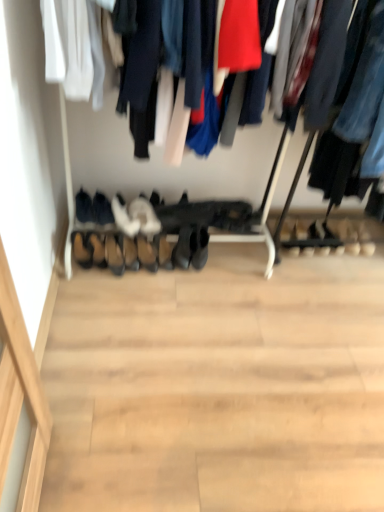
Measure the distance between brown leather shoe at lower center, which appears as the second shoe when viewed from the left, and camera.

The distance of brown leather shoe at lower center, which appears as the second shoe when viewed from the left, from camera is 2.08 meters.

This screenshot has width=384, height=512. Identify the location of brown leather shoe at lower center, which is the third shoe in right-to-left order. (96, 249).

Find the location of a particular element. Image resolution: width=384 pixels, height=512 pixels. brown suede shoes at center, acting as the third footwear starting from the left is located at coordinates (114, 255).

Measure the distance between point [117,251] and camera.

The distance of point [117,251] from camera is 6.87 feet.

Describe the element at coordinates (84, 207) in the screenshot. I see `black suede shoes at lower left, positioned as the 1th footwear in left-to-right order` at that location.

This screenshot has width=384, height=512. What are the coordinates of `white suede shoes at center, the 3th footwear when ordered from right to left` in the screenshot? It's located at (124, 217).

Image resolution: width=384 pixels, height=512 pixels. Describe the element at coordinates (147, 254) in the screenshot. I see `brown leather shoe at center, the 6th footwear viewed from the left` at that location.

Looking at this image, measure the distance between point (149, 261) and camera.

They are 2.13 meters apart.

At what (x,y) coordinates should I click in order to perform the action: click on white suede shoes at center, which is the 2th footwear in right-to-left order. Please return your answer as a coordinate pair (x, y). The image size is (384, 512). Looking at the image, I should click on (145, 216).

The height and width of the screenshot is (512, 384). Identify the location of brown leather shoe at lower center, which is the third shoe in right-to-left order. (96, 249).

Considering the positions of objects brown suede shoes at center, which is counted as the 4th footwear, starting from the right, and leather at center, the fourth shoe in the left-to-right sequence, in the image provided, who is more to the left, brown suede shoes at center, which is counted as the 4th footwear, starting from the right, or leather at center, the fourth shoe in the left-to-right sequence,?

brown suede shoes at center, which is counted as the 4th footwear, starting from the right, is more to the left.

Can you confirm if brown suede shoes at center, which is counted as the 4th footwear, starting from the right, is wider than leather at center, the fourth shoe in the left-to-right sequence?

Yes, brown suede shoes at center, which is counted as the 4th footwear, starting from the right, is wider than leather at center, the fourth shoe in the left-to-right sequence.

Where is `the 1st shoe above when counting from the brown suede shoes at center, which is counted as the 4th footwear, starting from the right (from the image's perspective)`? This screenshot has height=512, width=384. the 1st shoe above when counting from the brown suede shoes at center, which is counted as the 4th footwear, starting from the right (from the image's perspective) is located at coordinates (165, 253).

From the image's perspective, would you say white suede shoes at center, which is the 2th footwear in right-to-left order, is shown under brown leather shoe at lower center, which is the third shoe in right-to-left order?

No, from the image's perspective, white suede shoes at center, which is the 2th footwear in right-to-left order, is not below brown leather shoe at lower center, which is the third shoe in right-to-left order.

Can you confirm if white suede shoes at center, which is the 2th footwear in right-to-left order, is bigger than brown leather shoe at lower center, which is the third shoe in right-to-left order?

Correct, white suede shoes at center, which is the 2th footwear in right-to-left order, is larger in size than brown leather shoe at lower center, which is the third shoe in right-to-left order.

From the image's perspective, count 1st footwears upward from the brown leather shoe at lower center, which appears as the second shoe when viewed from the left, and point to it. Please provide its 2D coordinates.

[(145, 216)]

You are a GUI agent. You are given a task and a screenshot of the screen. Output one action in this format:
    pyautogui.click(x=<x>, y=<y>)
    Task: Click on the 3rd footwear above the white suede shoes at center, which is the 2th footwear in right-to-left order (from the image's perspective)
    The image size is (384, 512).
    Given the screenshot: What is the action you would take?
    pyautogui.click(x=84, y=207)

Does black suede shoes at lower left, positioned as the 1th footwear in left-to-right order, lie in front of white suede shoes at center, which is the 2th footwear in right-to-left order?

Yes, black suede shoes at lower left, positioned as the 1th footwear in left-to-right order, is in front of white suede shoes at center, which is the 2th footwear in right-to-left order.

Between black suede shoes at lower left, positioned as the 1th footwear in left-to-right order, and white suede shoes at center, which is the 2th footwear in right-to-left order, which one has more height?

black suede shoes at lower left, positioned as the 1th footwear in left-to-right order.

Considering the sizes of objects brown suede shoes at center, which is counted as the 4th footwear, starting from the right, and brown leather shoe at center, the 6th footwear viewed from the left, in the image provided, who is shorter, brown suede shoes at center, which is counted as the 4th footwear, starting from the right, or brown leather shoe at center, the 6th footwear viewed from the left,?

brown suede shoes at center, which is counted as the 4th footwear, starting from the right, is shorter.

In the image, there is a brown leather shoe at center, the 6th footwear viewed from the left. Identify the location of footwear below it (from the image's perspective). (114, 255).

From a real-world perspective, is brown suede shoes at center, acting as the third footwear starting from the left, located beneath brown leather shoe at center, which ranks as the 1th footwear in right-to-left order?

Indeed, from a real-world perspective, brown suede shoes at center, acting as the third footwear starting from the left, is positioned beneath brown leather shoe at center, which ranks as the 1th footwear in right-to-left order.

Considering the sizes of brown suede shoes at center, acting as the third footwear starting from the left, and brown leather shoe at center, the 6th footwear viewed from the left, in the image, is brown suede shoes at center, acting as the third footwear starting from the left, bigger or smaller than brown leather shoe at center, the 6th footwear viewed from the left,?

Clearly, brown suede shoes at center, acting as the third footwear starting from the left, is larger in size than brown leather shoe at center, the 6th footwear viewed from the left.

Does brown leather shoe at lower center, which appears as the second shoe when viewed from the left, come behind white suede shoes at center, the 3th footwear when ordered from right to left?

No, brown leather shoe at lower center, which appears as the second shoe when viewed from the left, is in front of white suede shoes at center, the 3th footwear when ordered from right to left.

What's the angular difference between brown leather shoe at lower center, which appears as the second shoe when viewed from the left, and white suede shoes at center, the 3th footwear when ordered from right to left,'s facing directions?

19 degrees.

Who is smaller, brown leather shoe at lower center, which is the third shoe in right-to-left order, or white suede shoes at center, the 3th footwear when ordered from right to left?

Smaller between the two is brown leather shoe at lower center, which is the third shoe in right-to-left order.

Is brown leather shoe at lower center, which is the third shoe in right-to-left order, to the right of white suede shoes at center, the 3th footwear when ordered from right to left, from the viewer's perspective?

No, brown leather shoe at lower center, which is the third shoe in right-to-left order, is not to the right of white suede shoes at center, the 3th footwear when ordered from right to left.

Considering the relative sizes of white suede shoes at center, which is the 2th footwear in right-to-left order, and leather shoes at center, the 2th shoe positioned from the right, in the image provided, is white suede shoes at center, which is the 2th footwear in right-to-left order, thinner than leather shoes at center, the 2th shoe positioned from the right,?

No.

From a real-world perspective, which shoe is the 3rd one underneath the white suede shoes at center, which is the fifth footwear from left to right? Please provide its 2D coordinates.

[(130, 253)]

Looking at this image, is white suede shoes at center, which is the 2th footwear in right-to-left order, far away from leather shoes at center, the 2th shoe positioned from the right?

No, white suede shoes at center, which is the 2th footwear in right-to-left order, is not far from leather shoes at center, the 2th shoe positioned from the right.

Relative to leather shoes at center, the 2th shoe positioned from the right, is white suede shoes at center, which is the 2th footwear in right-to-left order, in front or behind?

Clearly, white suede shoes at center, which is the 2th footwear in right-to-left order, is behind leather shoes at center, the 2th shoe positioned from the right.

What's the angular difference between brown leather shoe at lower center, which is the third shoe in right-to-left order, and brown suede shoes at center, acting as the third footwear starting from the left,'s facing directions?

The facing directions of brown leather shoe at lower center, which is the third shoe in right-to-left order, and brown suede shoes at center, acting as the third footwear starting from the left, are 0.00505 degrees apart.

Is brown leather shoe at lower center, which is the third shoe in right-to-left order, turned away from brown suede shoes at center, acting as the third footwear starting from the left?

No, brown leather shoe at lower center, which is the third shoe in right-to-left order, is not facing the opposite direction of brown suede shoes at center, acting as the third footwear starting from the left.

In the scene shown: Would you say brown leather shoe at lower center, which appears as the second shoe when viewed from the left, is outside brown suede shoes at center, which is counted as the 4th footwear, starting from the right?

Indeed, brown leather shoe at lower center, which appears as the second shoe when viewed from the left, is completely outside brown suede shoes at center, which is counted as the 4th footwear, starting from the right.

Which is behind, brown leather shoe at lower center, which appears as the second shoe when viewed from the left, or brown suede shoes at center, which is counted as the 4th footwear, starting from the right?

brown leather shoe at lower center, which appears as the second shoe when viewed from the left, is further away from the camera.

Where is `the 1st shoe positioned above the brown suede shoes at center, acting as the third footwear starting from the left (from the image's perspective)`? The height and width of the screenshot is (512, 384). the 1st shoe positioned above the brown suede shoes at center, acting as the third footwear starting from the left (from the image's perspective) is located at coordinates (165, 253).

Image resolution: width=384 pixels, height=512 pixels. There is a brown leather shoe at lower center, which appears as the second shoe when viewed from the left. Find the location of `the 1st footwear above it (from a real-world perspective)`. the 1st footwear above it (from a real-world perspective) is located at coordinates (145, 216).

From the image, which object appears to be farther from leather at center, which ranks as the 1th shoe in right-to-left order, white suede shoes at center, which is the fifth footwear from left to right, or brown leather shoe at center, which ranks as the 1th footwear in right-to-left order?

white suede shoes at center, which is the fifth footwear from left to right, lies further to leather at center, which ranks as the 1th shoe in right-to-left order, than the other object.

Which object lies further to the anchor point brown leather shoe at lower center, which is the third shoe in right-to-left order, white suede shoes at center, acting as the fourth footwear starting from the left, or white suede shoes at center, which is the 2th footwear in right-to-left order?

Based on the image, white suede shoes at center, which is the 2th footwear in right-to-left order, appears to be further to brown leather shoe at lower center, which is the third shoe in right-to-left order.

Which object lies further to the anchor point leather at center, which ranks as the 1th shoe in right-to-left order, white suede shoes at center, which is the 2th footwear in right-to-left order, or black suede shoes at lower left, which is counted as the 6th footwear, starting from the right?

black suede shoes at lower left, which is counted as the 6th footwear, starting from the right, lies further to leather at center, which ranks as the 1th shoe in right-to-left order, than the other object.

Considering their positions, is leather shoes at center, the third shoe from the left, positioned closer to brown suede shoes at center, acting as the third footwear starting from the left, than leather at left, positioned as the fourth shoe in right-to-left order?

leather shoes at center, the third shoe from the left.

Based on the photo, considering their positions, is black suede shoes at center, which is the fifth footwear from right to left, positioned closer to white suede shoes at center, the 3th footwear when ordered from right to left, than leather at left, the 1th shoe in the left-to-right sequence?

black suede shoes at center, which is the fifth footwear from right to left, is positioned closer to the anchor white suede shoes at center, the 3th footwear when ordered from right to left.

Based on their spatial positions, is black suede shoes at lower left, positioned as the 1th footwear in left-to-right order, or brown leather shoe at lower center, which appears as the second shoe when viewed from the left, closer to brown leather shoe at center, which ranks as the 1th footwear in right-to-left order?

brown leather shoe at lower center, which appears as the second shoe when viewed from the left.

When comparing their distances from white suede shoes at center, which is the 2th footwear in right-to-left order, does black suede shoes at lower left, positioned as the 1th footwear in left-to-right order, or black suede shoes at center, which is the second footwear in left-to-right order, seem further?

The object further to white suede shoes at center, which is the 2th footwear in right-to-left order, is black suede shoes at lower left, positioned as the 1th footwear in left-to-right order.

Looking at the image, which one is located closer to brown leather shoe at lower center, which is the third shoe in right-to-left order, white suede shoes at center, which is the 2th footwear in right-to-left order, or black suede shoes at lower left, positioned as the 1th footwear in left-to-right order?

black suede shoes at lower left, positioned as the 1th footwear in left-to-right order.

Where is `shoe between brown leather shoe at lower center, which appears as the second shoe when viewed from the left, and white suede shoes at center, which is the 2th footwear in right-to-left order, in the horizontal direction`? The width and height of the screenshot is (384, 512). shoe between brown leather shoe at lower center, which appears as the second shoe when viewed from the left, and white suede shoes at center, which is the 2th footwear in right-to-left order, in the horizontal direction is located at coordinates (130, 253).

I want to click on shoe situated between leather at left, the 1th shoe in the left-to-right sequence, and leather shoes at center, the third shoe from the left, from left to right, so click(x=96, y=249).

This screenshot has width=384, height=512. I want to click on shoe between white suede shoes at center, acting as the fourth footwear starting from the left, and leather at center, the fourth shoe in the left-to-right sequence, from left to right, so click(x=130, y=253).

Identify the location of shoe between brown suede shoes at center, which is counted as the 4th footwear, starting from the right, and leather at center, which ranks as the 1th shoe in right-to-left order, from left to right. [130, 253].